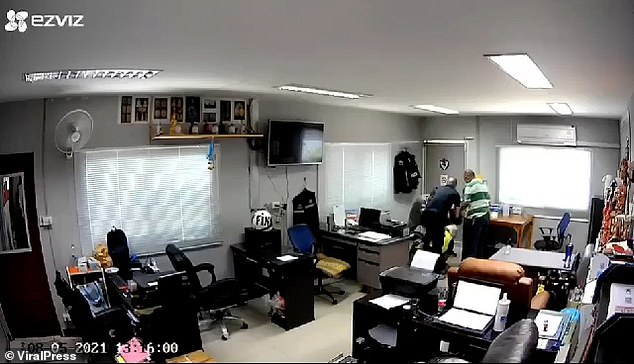
You are a GUI agent. You are given a task and a screenshot of the screen. Output one action in this format:
    pyautogui.click(x=<x>, y=<y>)
    Task: Click on the ceiling
    The image size is (634, 364).
    Given the screenshot: What is the action you would take?
    pyautogui.click(x=309, y=11)